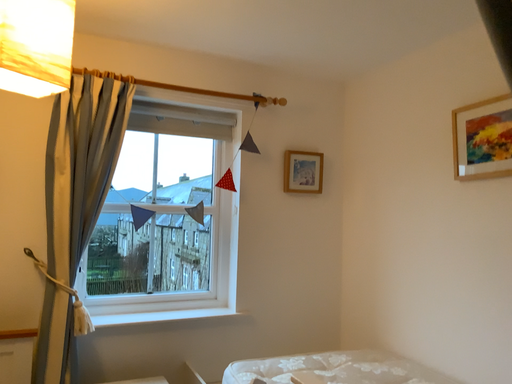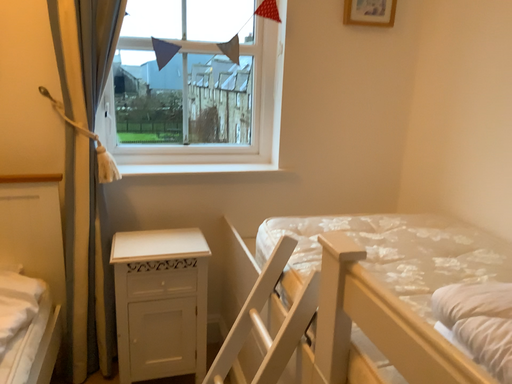
Question: How did the camera likely rotate when shooting the video?

Choices:
 (A) rotated downward
 (B) rotated upward

Answer: (A)